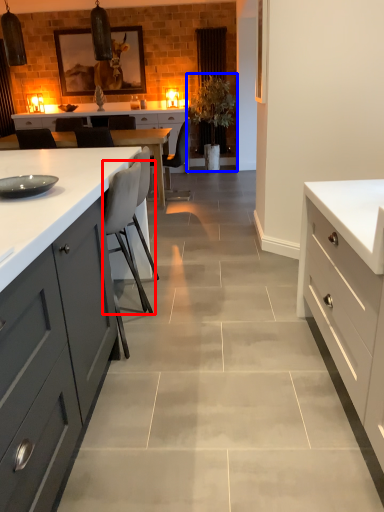
Question: Which object appears closest to the camera in this image, chair (highlighted by a red box) or plant (highlighted by a blue box)?

Choices:
 (A) chair
 (B) plant

Answer: (A)